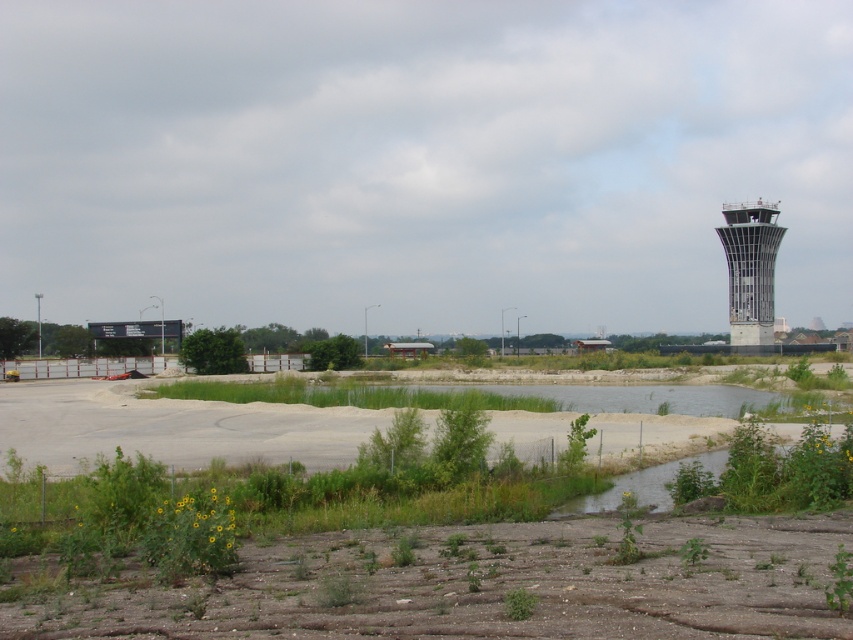
Is gray sandy dirt field at lower center positioned in front of metallic glass control tower at right?

Yes, gray sandy dirt field at lower center is closer to the viewer.

Is gray sandy dirt field at lower center further to the viewer compared to metallic glass control tower at right?

No, gray sandy dirt field at lower center is closer to the viewer.

Describe the element at coordinates (172, 426) in the screenshot. This screenshot has width=853, height=640. I see `gray sandy dirt field at lower center` at that location.

Find the location of a particular element. The height and width of the screenshot is (640, 853). gray sandy dirt field at lower center is located at coordinates (172, 426).